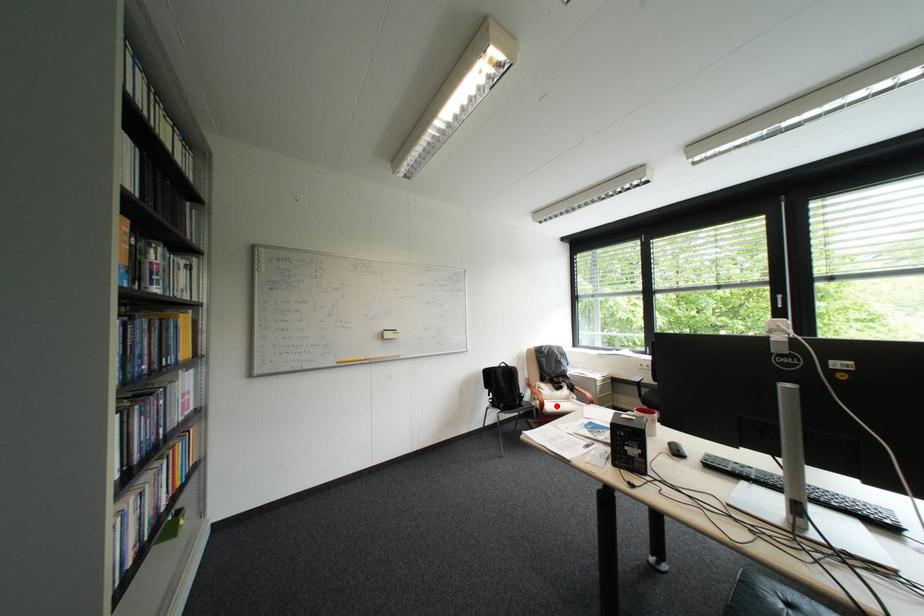
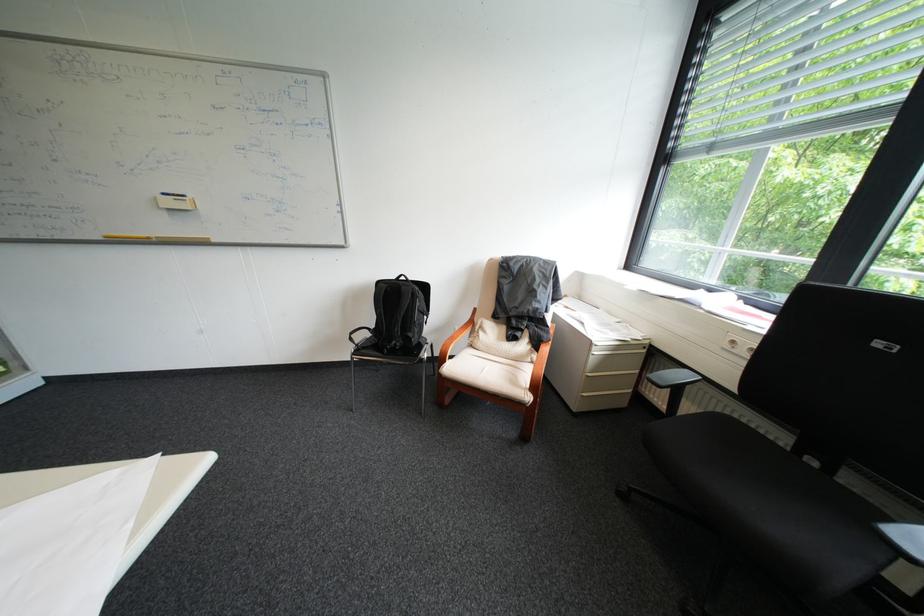
Question: I am providing you with two images of the same scene from different viewpoints. A red point is marked on the first image. At the location where the point appears in image 1, is it still visible in image 2?

Choices:
 (A) Yes
 (B) No

Answer: (A)